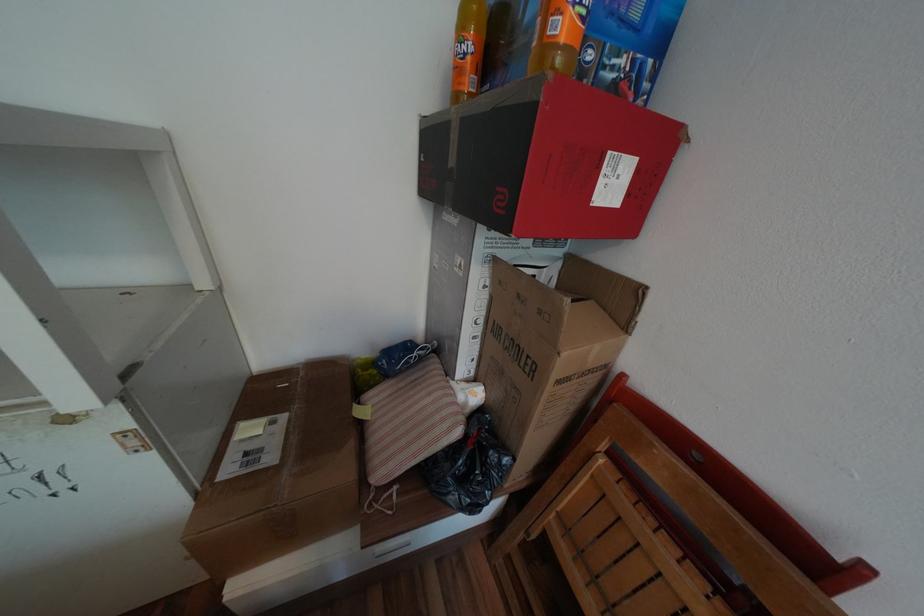
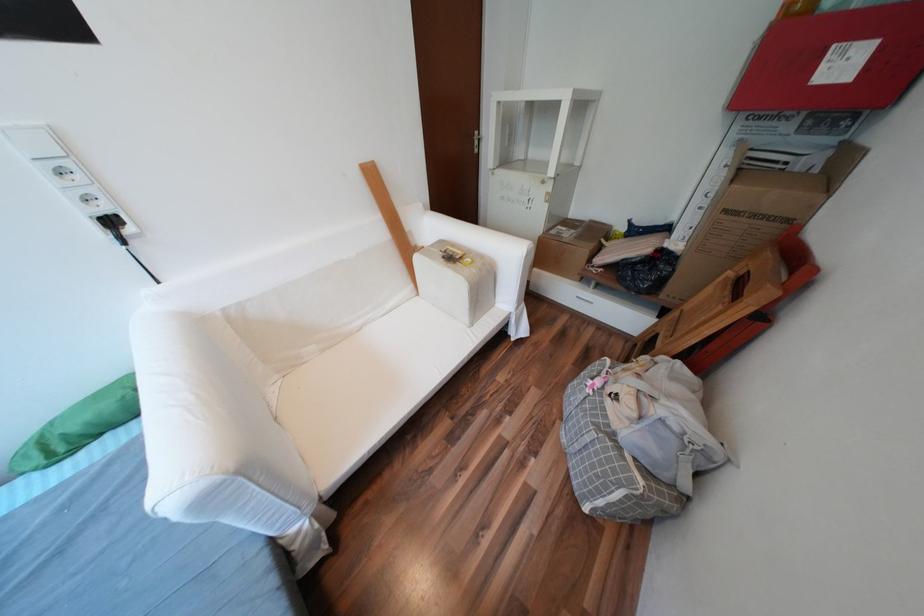
In the second image, find the point that corresponds to the point at 568,382 in the first image.

(736, 211)